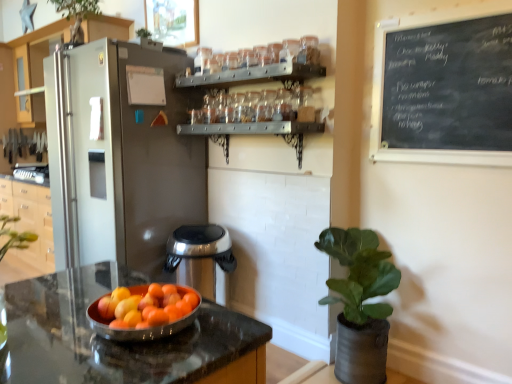
The image size is (512, 384). I want to click on free space above shiny metallic bowl at center (from a real-world perspective), so click(x=149, y=298).